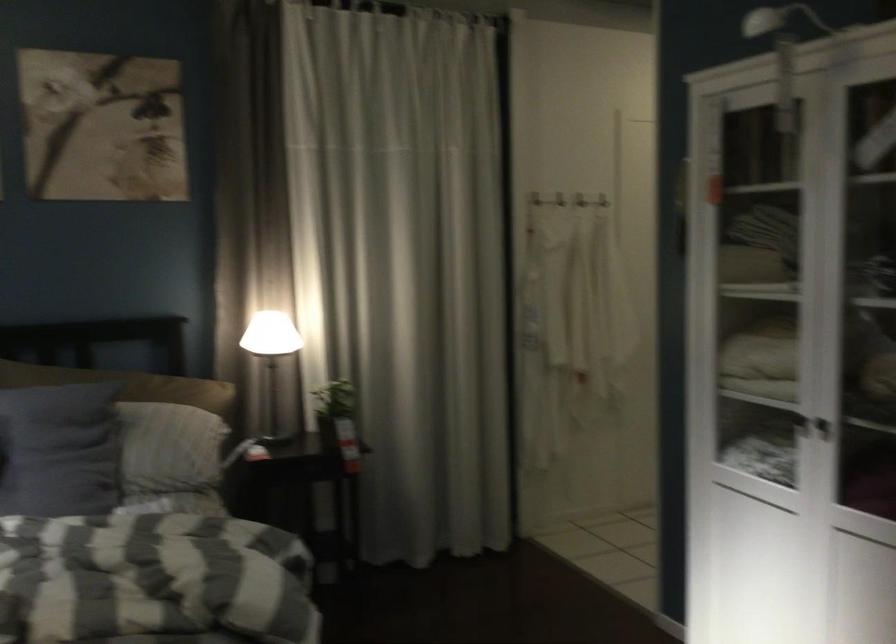
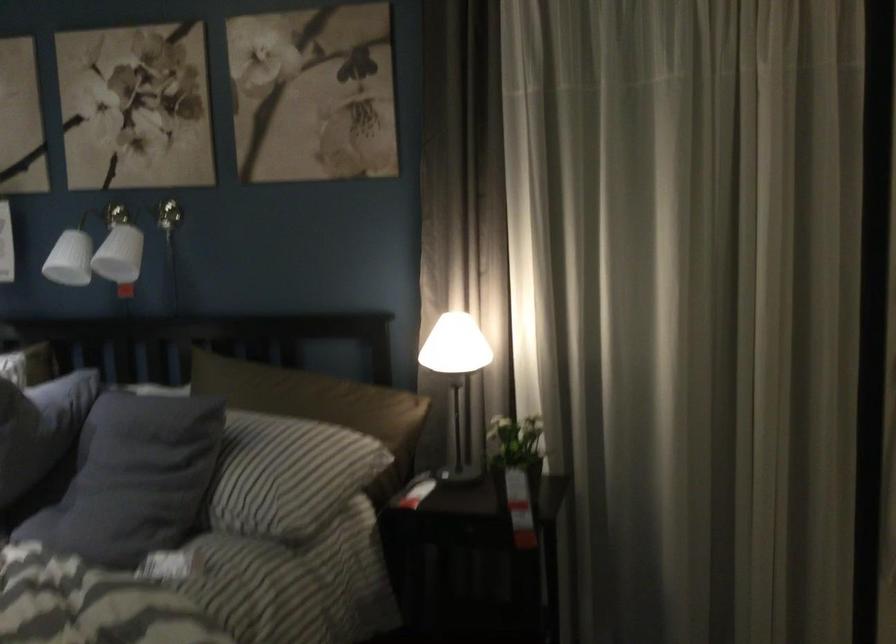
Locate, in the second image, the point that corresponds to pixel 471 451 in the first image.

(761, 540)